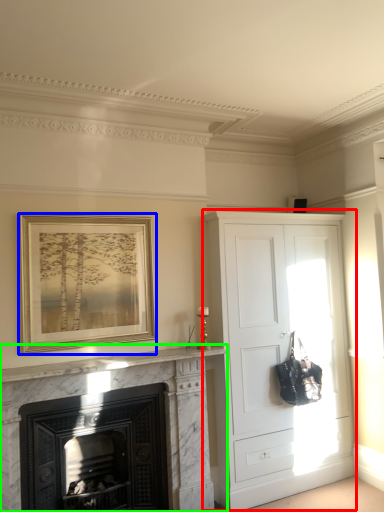
Question: Which object is the closest to the cupboard (highlighted by a red box)? Choose among these: picture frame (highlighted by a blue box) or fireplace (highlighted by a green box).

Choices:
 (A) picture frame
 (B) fireplace

Answer: (B)